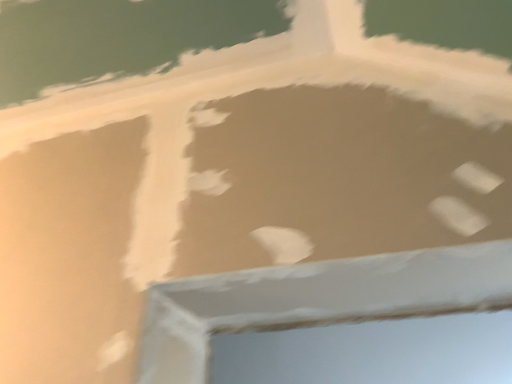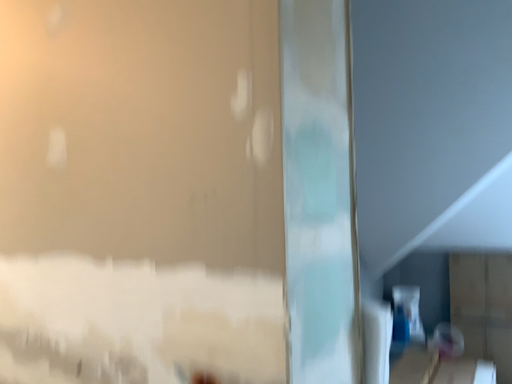
Question: Which way did the camera rotate in the video?

Choices:
 (A) rotated upward
 (B) rotated downward

Answer: (B)